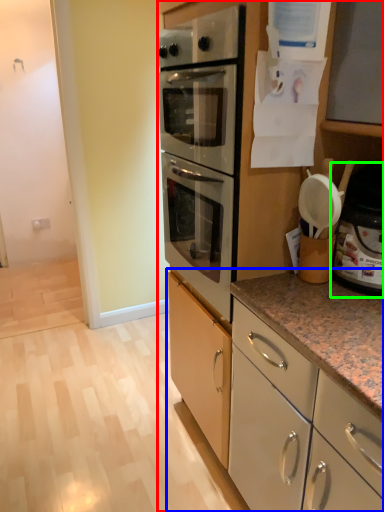
Question: Which object is positioned farthest from cabinetry (highlighted by a red box)? Select from cabinetry (highlighted by a blue box) and appliance (highlighted by a green box).

Choices:
 (A) cabinetry
 (B) appliance

Answer: (B)